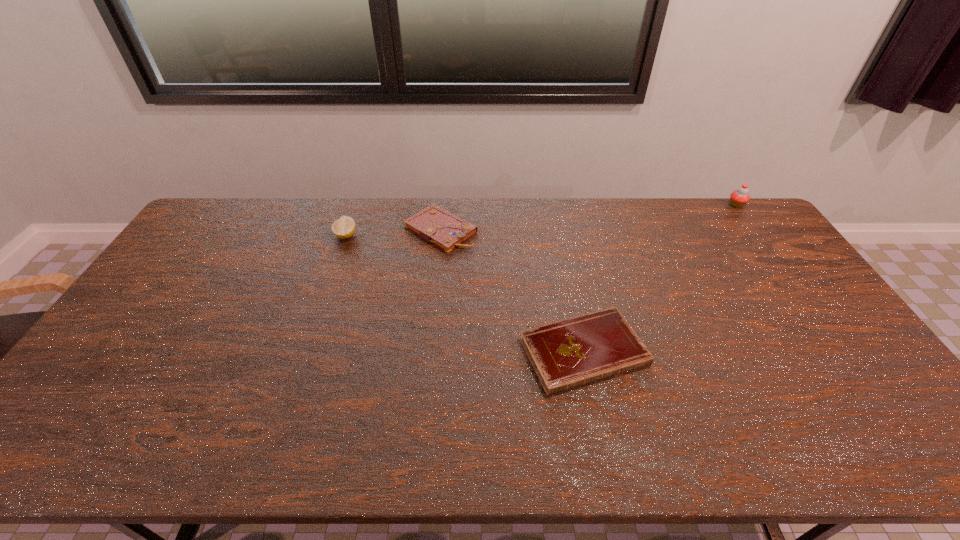
The width and height of the screenshot is (960, 540). What are the coordinates of `the tallest object` in the screenshot? It's located at (738, 198).

This screenshot has height=540, width=960. Identify the location of cupcake. (738, 198).

The height and width of the screenshot is (540, 960). Identify the location of lemon. (343, 228).

You are a GUI agent. You are given a task and a screenshot of the screen. Output one action in this format:
    pyautogui.click(x=<x>, y=<y>)
    Task: Click on the leftmost object
    This screenshot has height=540, width=960.
    Given the screenshot: What is the action you would take?
    pyautogui.click(x=343, y=228)

This screenshot has width=960, height=540. In order to click on the taller notebook in this screenshot , I will do `click(434, 224)`.

Find the location of a particular element. This screenshot has width=960, height=540. the farther notebook is located at coordinates (434, 224).

At what (x,y) coordinates should I click in order to perform the action: click on the third object from left to right. Please return your answer as a coordinate pair (x, y). The image size is (960, 540). Looking at the image, I should click on (570, 353).

Find the location of a particular element. Image resolution: width=960 pixels, height=540 pixels. the nearer notebook is located at coordinates (570, 353).

This screenshot has height=540, width=960. Find the location of `vacant space located on the left of the cupcake`. vacant space located on the left of the cupcake is located at coordinates (693, 205).

The height and width of the screenshot is (540, 960). Find the location of `vacant space located 0.310m on the front of the leftmost object`. vacant space located 0.310m on the front of the leftmost object is located at coordinates (319, 314).